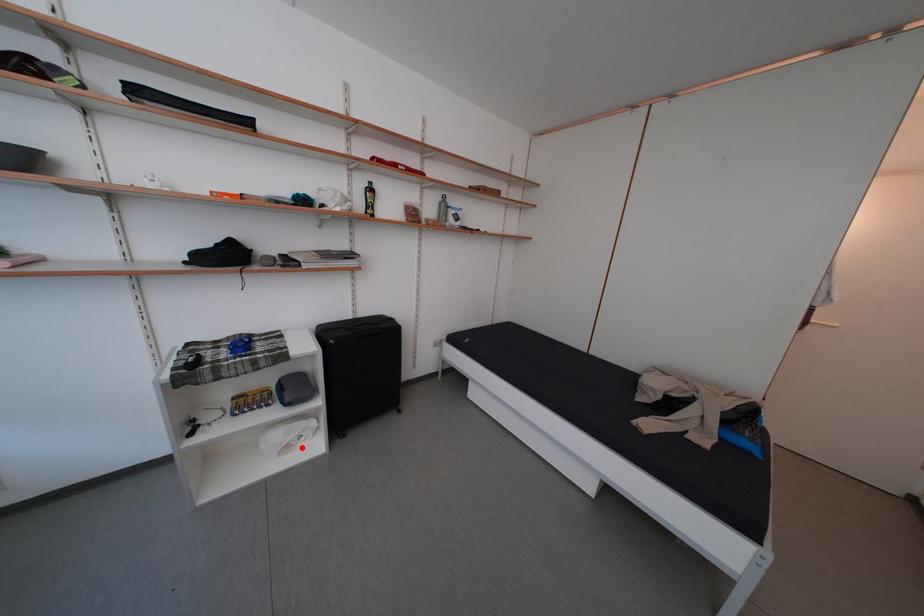
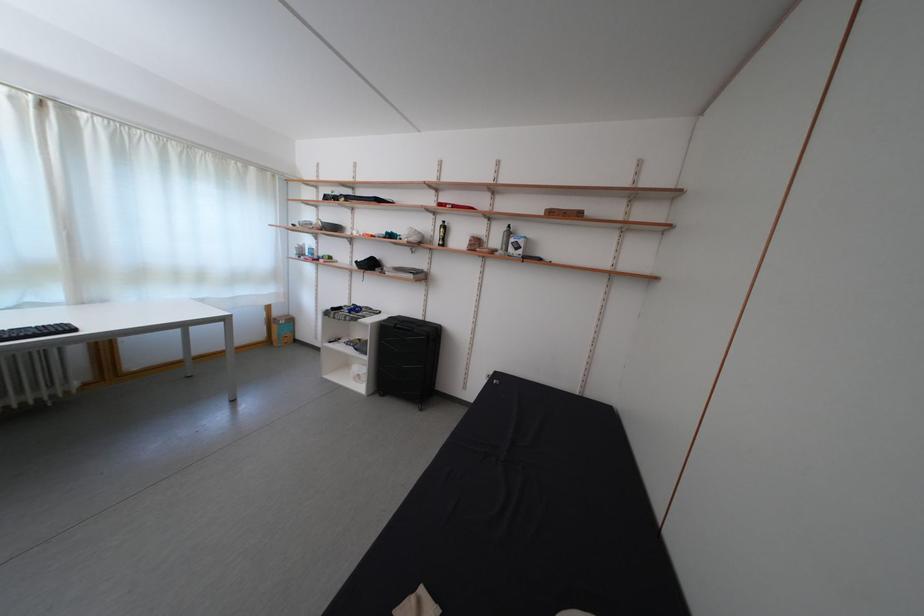
Question: A red point is marked in image1. In image2, is the corresponding 3D point closer to the camera or farther? Reply with the corresponding letter.

Choices:
 (A) The corresponding 3D point is closer.
 (B) The corresponding 3D point is farther.

Answer: (B)